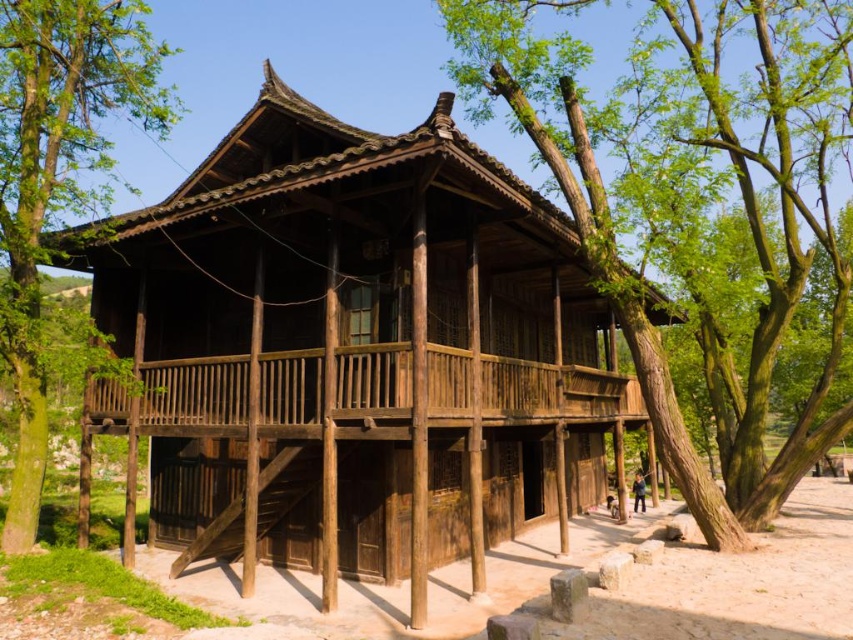
You are a visitor standing in front of the wooden house at center and the green wood tree at left. Which structure is wider?

The wooden house at center is wider than the green wood tree at left.